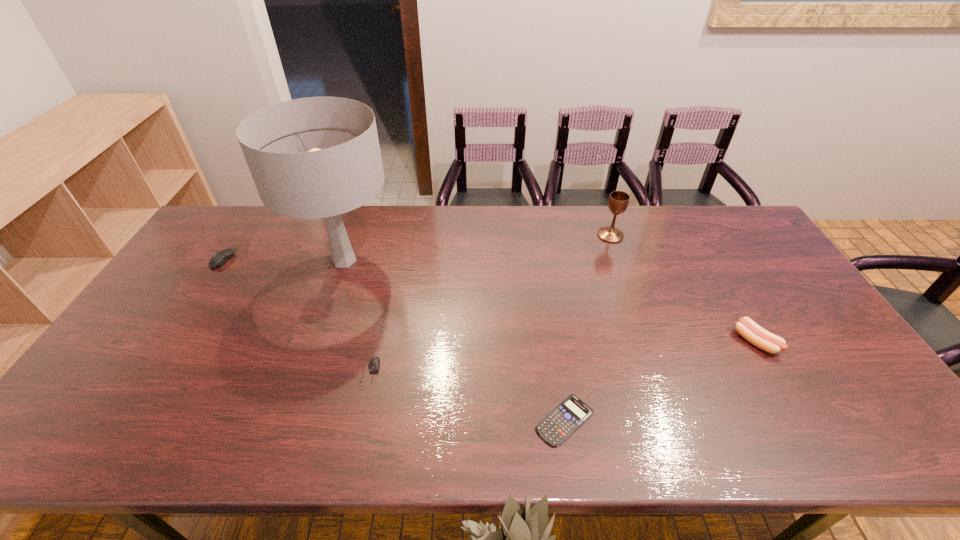
The width and height of the screenshot is (960, 540). Identify the location of object that is at the left edge. (219, 259).

In the image, there is a desktop. Identify the location of vacant space at the far edge. This screenshot has height=540, width=960. (445, 229).

Where is `free location at the near edge`? free location at the near edge is located at coordinates (233, 440).

You are a GUI agent. You are given a task and a screenshot of the screen. Output one action in this format:
    pyautogui.click(x=<x>, y=<y>)
    Task: Click on the vacant space at the left edge
    The width and height of the screenshot is (960, 540).
    Given the screenshot: What is the action you would take?
    pyautogui.click(x=207, y=258)

What are the coordinates of `vacant space at the right edge of the desktop` in the screenshot? It's located at (768, 319).

The height and width of the screenshot is (540, 960). Identify the location of free spot at the far left corner of the desktop. (258, 212).

Identify the location of empty space that is in between the fourth tallest object and the lampshade. (284, 260).

Identify the location of free space between the tallest object and the taller mouse. (284, 260).

In order to click on vacant point located between the third object from right to left and the tallest object in this screenshot , I will do `click(454, 340)`.

Find the location of a particular element. This screenshot has height=540, width=960. free space between the shortest object and the lampshade is located at coordinates (454, 340).